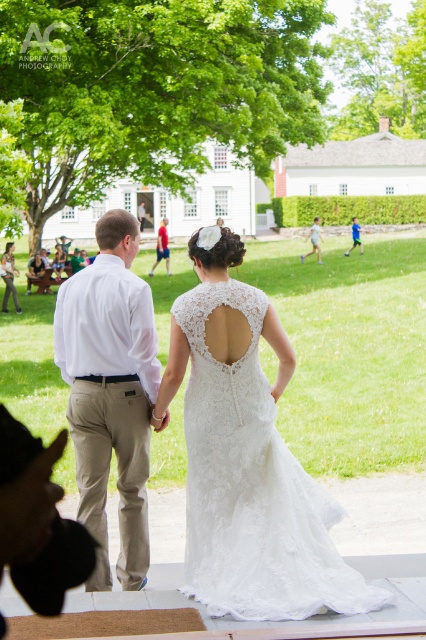
Is point (288, 608) closer to camera compared to point (9, 266)?

Yes.

Can you confirm if lace/embroidered dress at center is thinner than matte white dress at center?

In fact, lace/embroidered dress at center might be wider than matte white dress at center.

What do you see at coordinates (253, 486) in the screenshot? The height and width of the screenshot is (640, 426). I see `lace/embroidered dress at center` at bounding box center [253, 486].

Locate an element on the screen. This screenshot has height=640, width=426. lace/embroidered dress at center is located at coordinates (253, 486).

Is white cotton shirt at center closer to camera compared to blue cotton shirt at center?

That is True.

Looking at this image, which of these two, white cotton shirt at center or blue cotton shirt at center, stands shorter?

With less height is white cotton shirt at center.

Describe the element at coordinates (111, 392) in the screenshot. The height and width of the screenshot is (640, 426). I see `white cotton shirt at center` at that location.

Where is `white cotton shirt at center`? The height and width of the screenshot is (640, 426). white cotton shirt at center is located at coordinates (111, 392).

Is lace/embroidered dress at center closer to camera compared to white lace dress at center?

That is True.

Does lace/embroidered dress at center lie behind white lace dress at center?

No, it is not.

Which is behind, point (193, 563) or point (22, 298)?

The point (22, 298) is more distant.

Where is `lace/embroidered dress at center`? lace/embroidered dress at center is located at coordinates (253, 486).